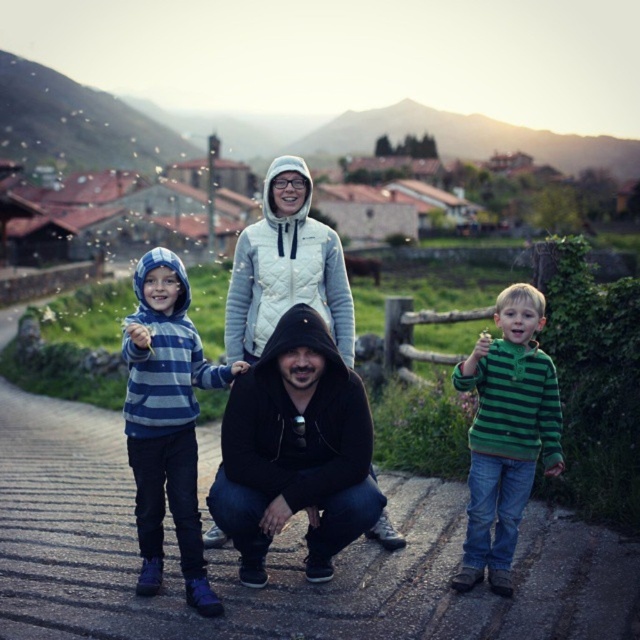
The height and width of the screenshot is (640, 640). What do you see at coordinates (296, 451) in the screenshot? I see `black hoodie at center` at bounding box center [296, 451].

Is point (269, 451) positioned in front of point (176, 531)?

Yes.

Between point (356, 474) and point (200, 556), which one is positioned behind?

Positioned behind is point (200, 556).

Where is `black hoodie at center`? black hoodie at center is located at coordinates (296, 451).

Between point (118, 618) and point (150, 278), which one is positioned in front?

Point (118, 618) is in front.

Between dark asphalt road at center and striped cotton hoodie at left, which one appears on the left side from the viewer's perspective?

Positioned to the left is striped cotton hoodie at left.

What are the coordinates of `dark asphalt road at center` in the screenshot? It's located at [x=273, y=557].

Does green striped sweater at right have a lesser height compared to white quilted jacket at upper center?

Indeed, green striped sweater at right has a lesser height compared to white quilted jacket at upper center.

Who is more forward, (492, 502) or (323, 227)?

Positioned in front is point (492, 502).

Find the location of a particular element. Image resolution: width=640 pixels, height=640 pixels. green striped sweater at right is located at coordinates (506, 433).